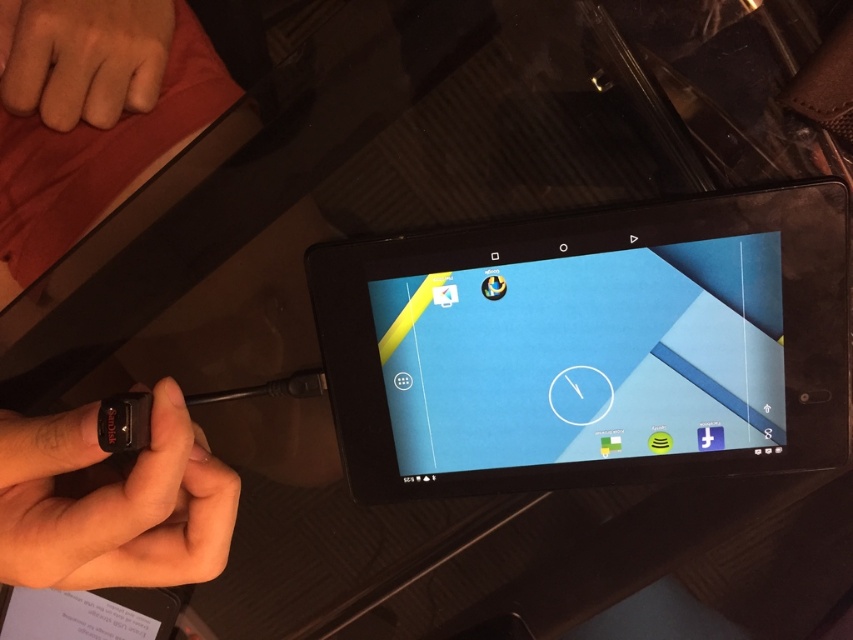
In the scene shown: You are trying to plug the USB drive into the tablet. Based on the image, which point is closer to you, the point at coordinates point (785, 465) or point (120, 522)?

Point (785, 465) is further to the camera than point (120, 522), so point (120, 522) is closer to you.

Consider the image. You are holding a stylus that is 12 inches long. You want to place it on the black plastic tablet at center without it hanging off the edges. Is the stylus short enough to fit entirely on the tablet?

The distance of black plastic tablet at center from viewer is 17.29 inches. Since the stylus is 12 inches long, it is shorter than the tablet, so it should fit without hanging off the edges.